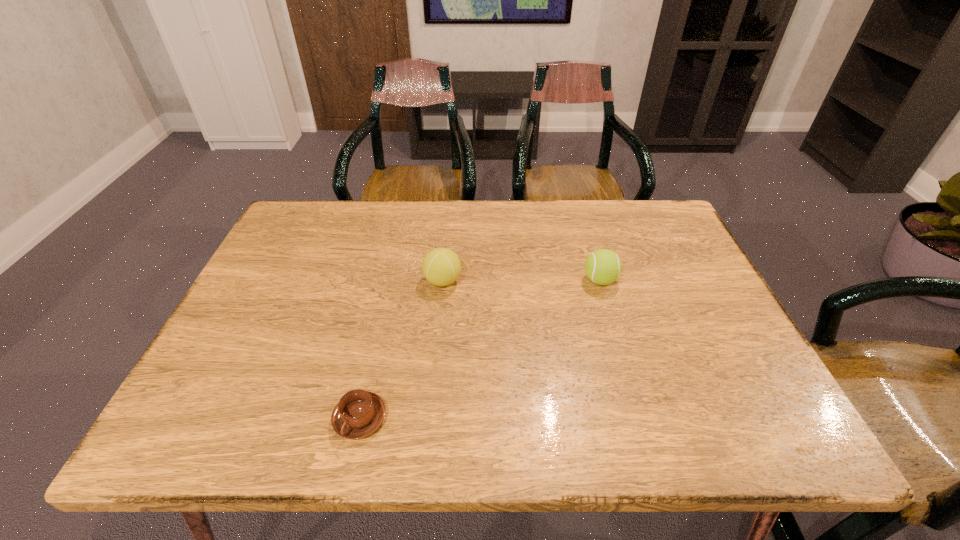
At what (x,y) coordinates should I click in order to perform the action: click on the second object from right to left. Please return your answer as a coordinate pair (x, y). The image size is (960, 540). Looking at the image, I should click on pyautogui.click(x=441, y=267).

Locate an element on the screen. This screenshot has height=540, width=960. the rightmost object is located at coordinates (603, 266).

At what (x,y) coordinates should I click in order to perform the action: click on the shortest object. Please return your answer as a coordinate pair (x, y). Image resolution: width=960 pixels, height=540 pixels. Looking at the image, I should click on (359, 413).

Locate an element on the screen. cappuccino is located at coordinates pos(359,413).

At what (x,y) coordinates should I click in order to perform the action: click on free location located 0.310m on the left of the left tennis ball. Please return your answer as a coordinate pair (x, y). The height and width of the screenshot is (540, 960). Looking at the image, I should click on (303, 281).

Identify the location of vacant region located on the left of the right tennis ball. This screenshot has width=960, height=540. (462, 280).

The image size is (960, 540). Identify the location of object positioned at the near edge. (359, 413).

This screenshot has width=960, height=540. Find the location of `vacant space at the far edge of the desktop`. vacant space at the far edge of the desktop is located at coordinates pos(591,238).

The width and height of the screenshot is (960, 540). I want to click on vacant area at the near edge, so click(486, 442).

Identify the location of free location at the left edge. Image resolution: width=960 pixels, height=540 pixels. (239, 390).